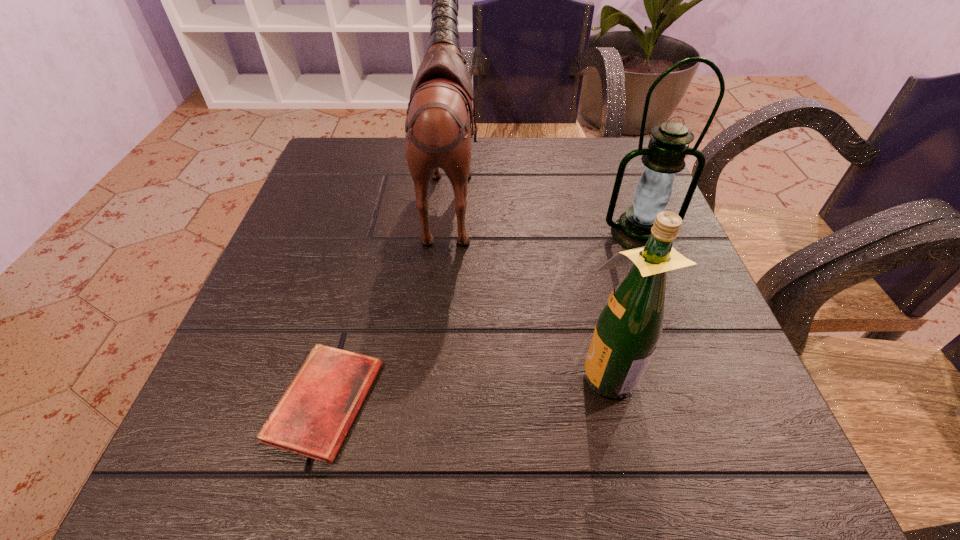
Identify which object is the closest to the leftmost object. Please provide its 2D coordinates. Your answer should be formatted as a tuple, i.e. [(x, y)], where the tuple contains the x and y coordinates of a point satisfying the conditions above.

[(437, 129)]

The image size is (960, 540). I want to click on vacant region that satisfies the following two spatial constraints: 1. on the side where the lantern emits light; 2. on the front-facing side of the third object from left to right, so 692,372.

Where is `vacant region that satisfies the following two spatial constraints: 1. on the side where the lantern emits light; 2. on the front-facing side of the liquor`? This screenshot has width=960, height=540. vacant region that satisfies the following two spatial constraints: 1. on the side where the lantern emits light; 2. on the front-facing side of the liquor is located at coordinates (692, 372).

Locate an element on the screen. Image resolution: width=960 pixels, height=540 pixels. vacant area in the image that satisfies the following two spatial constraints: 1. on the side where the rightmost object emits light; 2. on the front-facing side of the second object from right to left is located at coordinates (692, 372).